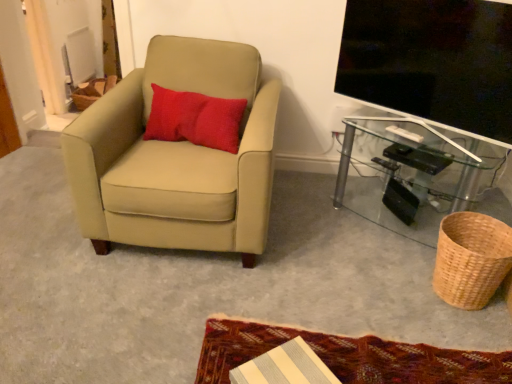
Locate an element on the screen. blank area beneath transparent glass table at lower right (from a real-world perspective) is located at coordinates (389, 214).